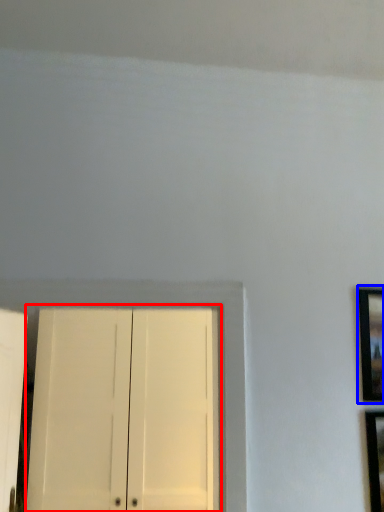
Question: Which of the following is the farthest to the observer, door (highlighted by a red box) or picture frame (highlighted by a blue box)?

Choices:
 (A) door
 (B) picture frame

Answer: (A)